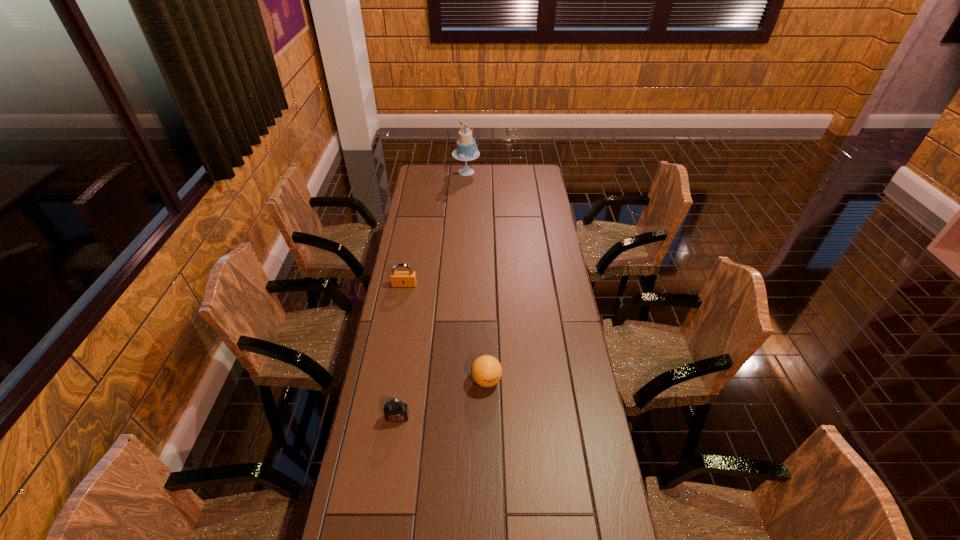
Identify the location of free location at the far edge. (492, 173).

Find the location of a particular element. vacant area at the left edge is located at coordinates (411, 299).

In the image, there is a desktop. Identify the location of vacant region at the right edge. (540, 228).

I want to click on vacant space that is in between the tallest object and the third nearest object, so click(x=435, y=228).

Find the location of a particular element. free space between the second farthest object and the ping-pong ball is located at coordinates (445, 333).

Find the location of `free space between the tallest object and the farther padlock`. free space between the tallest object and the farther padlock is located at coordinates (435, 228).

In order to click on empty location between the nearer padlock and the farthest object in this screenshot , I will do `click(432, 294)`.

Find the location of a particular element. vacant region between the nearer padlock and the third farthest object is located at coordinates (442, 399).

Locate an element on the screen. The image size is (960, 540). free space between the second farthest object and the farthest object is located at coordinates (435, 228).

The image size is (960, 540). I want to click on empty space between the nearer padlock and the second nearest object, so click(442, 399).